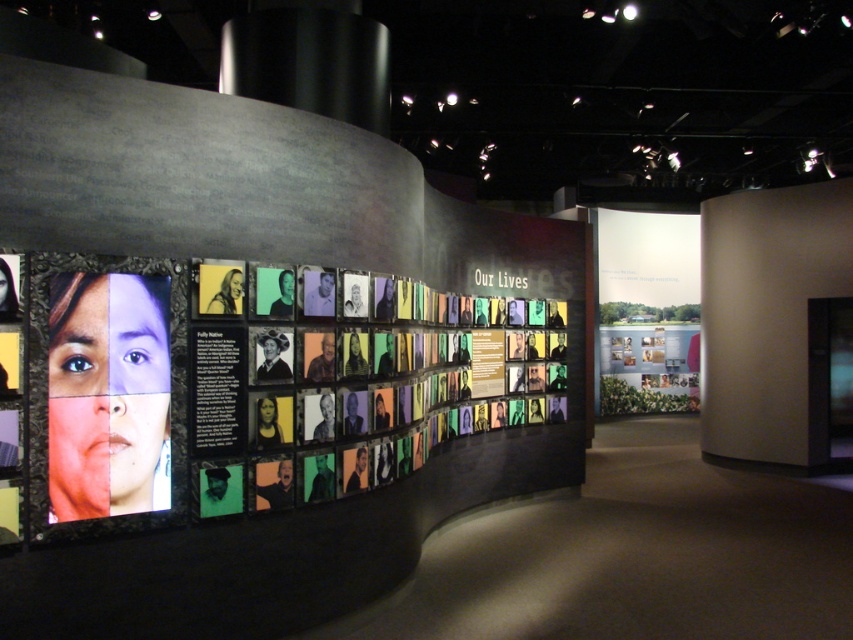
Who is positioned more to the left, matte plastic poster at left or matte paper poster at center?

From the viewer's perspective, matte plastic poster at left appears more on the left side.

Where is `matte plastic poster at left`? This screenshot has height=640, width=853. matte plastic poster at left is located at coordinates (108, 396).

Image resolution: width=853 pixels, height=640 pixels. I want to click on matte plastic poster at left, so click(x=108, y=396).